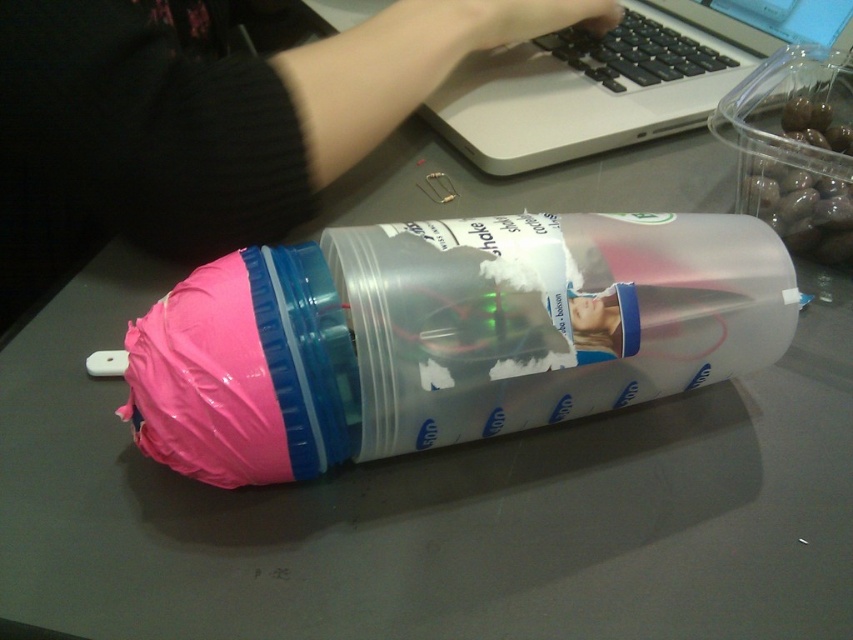
Is silver metallic laptop at upper center taller than pink matte plastic hand at upper center?

Correct, silver metallic laptop at upper center is much taller as pink matte plastic hand at upper center.

Measure the distance between point (825, 22) and camera.

They are 29.89 inches apart.

Does point (630, 144) come farther from viewer compared to point (618, 12)?

No, it is in front of (618, 12).

Where is `silver metallic laptop at upper center`? silver metallic laptop at upper center is located at coordinates coord(619,77).